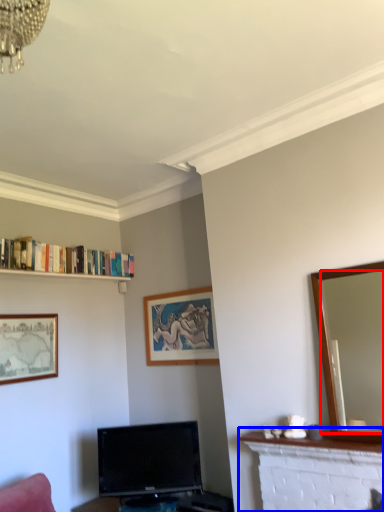
Question: Which object appears closest to the camera in this image, mirror (highlighted by a red box) or fireplace (highlighted by a blue box)?

Choices:
 (A) mirror
 (B) fireplace

Answer: (A)